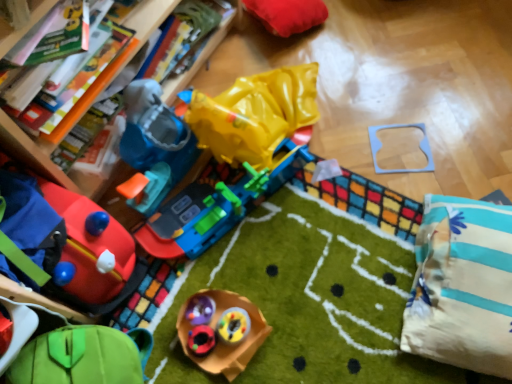
Identify the location of free spot above green fabric toy at lower left, the 7th toy in the top-to-bottom sequence (from a real-world perspective). This screenshot has height=384, width=512. (47, 359).